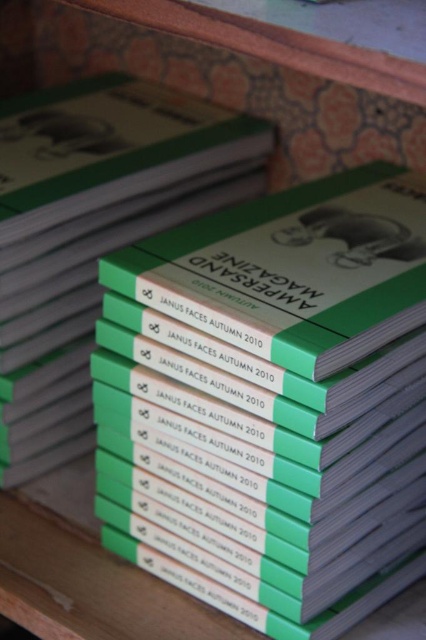
Question: Is green matte paper at center to the left of green matte magazine at center from the viewer's perspective?

Choices:
 (A) no
 (B) yes

Answer: (B)

Question: Which object is farther from the camera taking this photo?

Choices:
 (A) green matte paper at center
 (B) green matte magazine at center

Answer: (A)

Question: Which point is farther to the camera?

Choices:
 (A) (29, 236)
 (B) (371, 300)

Answer: (A)

Question: Does green matte paper at center appear over green matte magazine at center?

Choices:
 (A) yes
 (B) no

Answer: (A)

Question: Which point appears closest to the camera in this image?

Choices:
 (A) (397, 280)
 (B) (5, 458)

Answer: (A)

Question: Is green matte paper at center above green matte magazine at center?

Choices:
 (A) no
 (B) yes

Answer: (B)